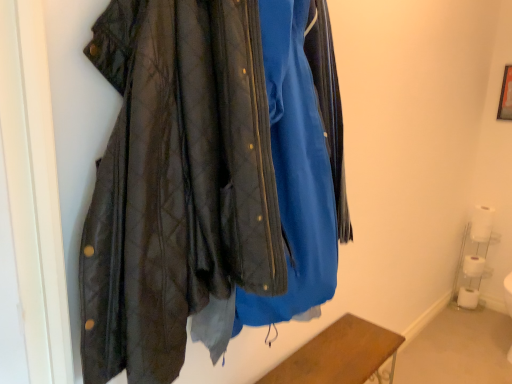
This screenshot has width=512, height=384. What do you see at coordinates (468, 298) in the screenshot?
I see `white matte toilet paper at lower right, positioned as the 1th toilet paper in bottom-to-top order` at bounding box center [468, 298].

Locate an element on the screen. The width and height of the screenshot is (512, 384). white matte toilet paper at lower right, which is counted as the 3th toilet paper, starting from the top is located at coordinates (473, 266).

What's the angular difference between white matte toilet paper at lower right, the fourth toilet paper positioned from the bottom, and white matte toilet paper at lower right, positioned as the 1th toilet paper in bottom-to-top order,'s facing directions?

A: There is a 0.0113-degree angle between the facing directions of white matte toilet paper at lower right, the fourth toilet paper positioned from the bottom, and white matte toilet paper at lower right, positioned as the 1th toilet paper in bottom-to-top order.

Is white matte toilet paper at lower right, which appears as the 1th toilet paper when viewed from the top, wider or thinner than white matte toilet paper at lower right, positioned as the 1th toilet paper in bottom-to-top order?

Considering their sizes, white matte toilet paper at lower right, which appears as the 1th toilet paper when viewed from the top, looks slimmer than white matte toilet paper at lower right, positioned as the 1th toilet paper in bottom-to-top order.

Would you say white matte toilet paper at lower right, the fourth toilet paper in the top-to-bottom sequence, is part of white matte toilet paper at lower right, the fourth toilet paper positioned from the bottom,'s contents?

No, white matte toilet paper at lower right, the fourth toilet paper in the top-to-bottom sequence, is located outside of white matte toilet paper at lower right, the fourth toilet paper positioned from the bottom.

From the image's perspective, which is below, white matte toilet paper at lower right, the fourth toilet paper positioned from the bottom, or white matte toilet paper at lower right, the fourth toilet paper in the top-to-bottom sequence?

white matte toilet paper at lower right, the fourth toilet paper in the top-to-bottom sequence, from the image's perspective.

Looking at this image, is white matte toilet paper at lower right, the fourth toilet paper positioned from the bottom, placed right next to brown wooden table at lower center?

No.

From the image's perspective, is white matte toilet paper at lower right, the fourth toilet paper positioned from the bottom, located above or below brown wooden table at lower center?

From the image's perspective, white matte toilet paper at lower right, the fourth toilet paper positioned from the bottom, appears above brown wooden table at lower center.

Is white matte toilet paper at lower right, the fourth toilet paper positioned from the bottom, oriented towards brown wooden table at lower center?

Yes, white matte toilet paper at lower right, the fourth toilet paper positioned from the bottom, is aimed at brown wooden table at lower center.

Based on the photo, considering the sizes of objects white matte toilet paper at lower right, the fourth toilet paper positioned from the bottom, and brown wooden table at lower center in the image provided, who is wider, white matte toilet paper at lower right, the fourth toilet paper positioned from the bottom, or brown wooden table at lower center?

Wider between the two is brown wooden table at lower center.

Are white matte toilet paper at lower right, which appears as the 1th toilet paper when viewed from the top, and wooden frame at upper right making contact?

No, white matte toilet paper at lower right, which appears as the 1th toilet paper when viewed from the top, is not touching wooden frame at upper right.

Which of these two, white matte toilet paper at lower right, which appears as the 1th toilet paper when viewed from the top, or wooden frame at upper right, is smaller?

With smaller size is wooden frame at upper right.

Consider the image. How distant is white matte toilet paper at lower right, the fourth toilet paper positioned from the bottom, from wooden frame at upper right?

white matte toilet paper at lower right, the fourth toilet paper positioned from the bottom, is 27.10 inches from wooden frame at upper right.

Does white matte toilet paper at lower right, which appears as the 1th toilet paper when viewed from the top, turn towards wooden frame at upper right?

No, white matte toilet paper at lower right, which appears as the 1th toilet paper when viewed from the top, is not facing towards wooden frame at upper right.

Based on the photo, does white matte toilet paper at lower right, the fourth toilet paper in the top-to-bottom sequence, have a lesser height compared to white plastic shelf at lower right?

Yes.

Which is behind, point (476, 305) or point (478, 267)?

Point (476, 305)

From the image's perspective, is white matte toilet paper at lower right, positioned as the 1th toilet paper in bottom-to-top order, under white plastic shelf at lower right?

Yes.

Do you think white matte toilet paper at lower right, positioned as the 1th toilet paper in bottom-to-top order, is within white plastic shelf at lower right, or outside of it?

white matte toilet paper at lower right, positioned as the 1th toilet paper in bottom-to-top order, is contained in white plastic shelf at lower right.

Is wooden frame at upper right positioned with its back to white paper towel at lower right, arranged as the second toilet paper when viewed from the top?

No, white paper towel at lower right, arranged as the second toilet paper when viewed from the top, is not at the back of wooden frame at upper right.

Is wooden frame at upper right in front of or behind white paper towel at lower right, which is the 3th toilet paper in bottom-to-top order, in the image?

wooden frame at upper right is in front of white paper towel at lower right, which is the 3th toilet paper in bottom-to-top order.

Is wooden frame at upper right taller than white paper towel at lower right, which is the 3th toilet paper in bottom-to-top order?

Yes.

Are white paper towel at lower right, arranged as the second toilet paper when viewed from the top, and white plastic shelf at lower right beside each other?

No, white paper towel at lower right, arranged as the second toilet paper when viewed from the top, is not next to white plastic shelf at lower right.

Is white paper towel at lower right, which is the 3th toilet paper in bottom-to-top order, surrounding white plastic shelf at lower right?

No.

In the scene shown: Is white paper towel at lower right, which is the 3th toilet paper in bottom-to-top order, looking in the opposite direction of white plastic shelf at lower right?

white paper towel at lower right, which is the 3th toilet paper in bottom-to-top order, is not turned away from white plastic shelf at lower right.

Is white matte toilet paper at lower right, the fourth toilet paper in the top-to-bottom sequence, surrounded by white paper towel at lower right, which is the 3th toilet paper in bottom-to-top order?

Definitely not — white matte toilet paper at lower right, the fourth toilet paper in the top-to-bottom sequence, is not inside white paper towel at lower right, which is the 3th toilet paper in bottom-to-top order.

From the image's perspective, which object appears higher, white paper towel at lower right, which is the 3th toilet paper in bottom-to-top order, or white matte toilet paper at lower right, positioned as the 1th toilet paper in bottom-to-top order?

white paper towel at lower right, which is the 3th toilet paper in bottom-to-top order, from the image's perspective.

Are white paper towel at lower right, which is the 3th toilet paper in bottom-to-top order, and white matte toilet paper at lower right, positioned as the 1th toilet paper in bottom-to-top order, beside each other?

No, white paper towel at lower right, which is the 3th toilet paper in bottom-to-top order, is not next to white matte toilet paper at lower right, positioned as the 1th toilet paper in bottom-to-top order.

Considering the sizes of objects white paper towel at lower right, which is the 3th toilet paper in bottom-to-top order, and white matte toilet paper at lower right, positioned as the 1th toilet paper in bottom-to-top order, in the image provided, who is taller, white paper towel at lower right, which is the 3th toilet paper in bottom-to-top order, or white matte toilet paper at lower right, positioned as the 1th toilet paper in bottom-to-top order,?

With more height is white matte toilet paper at lower right, positioned as the 1th toilet paper in bottom-to-top order.

Which toilet paper is the 2nd one when counting from the left side of the white matte toilet paper at lower right, which appears as the 1th toilet paper when viewed from the top? Please provide its 2D coordinates.

[(468, 298)]

I want to click on toilet paper that is the 4th one when counting rightward from the brown wooden table at lower center, so click(x=482, y=223).

Looking at the image, which one is located further to white paper towel at lower right, which is the 3th toilet paper in bottom-to-top order, brown wooden table at lower center or white matte toilet paper at lower right, which is the second toilet paper in bottom-to-top order?

brown wooden table at lower center is positioned further to the anchor white paper towel at lower right, which is the 3th toilet paper in bottom-to-top order.

Considering their positions, is white matte toilet paper at lower right, which appears as the 1th toilet paper when viewed from the top, positioned further to white matte toilet paper at lower right, which is counted as the 3th toilet paper, starting from the top, than white plastic shelf at lower right?

white matte toilet paper at lower right, which appears as the 1th toilet paper when viewed from the top, is further to white matte toilet paper at lower right, which is counted as the 3th toilet paper, starting from the top.

Looking at the image, which one is located further to wooden frame at upper right, brown wooden table at lower center or white matte toilet paper at lower right, which is counted as the 3th toilet paper, starting from the top?

Based on the image, brown wooden table at lower center appears to be further to wooden frame at upper right.

Based on their spatial positions, is white matte toilet paper at lower right, which is the second toilet paper in bottom-to-top order, or white matte toilet paper at lower right, which appears as the 1th toilet paper when viewed from the top, closer to wooden frame at upper right?

Based on the image, white matte toilet paper at lower right, which appears as the 1th toilet paper when viewed from the top, appears to be nearer to wooden frame at upper right.

From the image, which object appears to be nearer to white matte toilet paper at lower right, which appears as the 1th toilet paper when viewed from the top, white matte toilet paper at lower right, which is counted as the 3th toilet paper, starting from the top, or white matte toilet paper at lower right, the fourth toilet paper in the top-to-bottom sequence?

white matte toilet paper at lower right, which is counted as the 3th toilet paper, starting from the top.

Which object lies nearer to the anchor point white plastic shelf at lower right, wooden frame at upper right or white matte toilet paper at lower right, the fourth toilet paper in the top-to-bottom sequence?

Among the two, white matte toilet paper at lower right, the fourth toilet paper in the top-to-bottom sequence, is located nearer to white plastic shelf at lower right.

From the image, which object appears to be farther from brown wooden table at lower center, white paper towel at lower right, arranged as the second toilet paper when viewed from the top, or white matte toilet paper at lower right, which is the second toilet paper in bottom-to-top order?

Based on the image, white paper towel at lower right, arranged as the second toilet paper when viewed from the top, appears to be further to brown wooden table at lower center.

Estimate the real-world distances between objects in this image. Which object is further from wooden frame at upper right, white matte toilet paper at lower right, the fourth toilet paper positioned from the bottom, or white matte toilet paper at lower right, which is the second toilet paper in bottom-to-top order?

white matte toilet paper at lower right, which is the second toilet paper in bottom-to-top order, lies further to wooden frame at upper right than the other object.

This screenshot has width=512, height=384. Identify the location of shelf between brown wooden table at lower center and white paper towel at lower right, which is the 3th toilet paper in bottom-to-top order, in the front-back direction. (473, 262).

Where is `toilet paper between white paper towel at lower right, which is the 3th toilet paper in bottom-to-top order, and white matte toilet paper at lower right, positioned as the 1th toilet paper in bottom-to-top order, from top to bottom`? toilet paper between white paper towel at lower right, which is the 3th toilet paper in bottom-to-top order, and white matte toilet paper at lower right, positioned as the 1th toilet paper in bottom-to-top order, from top to bottom is located at coordinates (473, 266).

Locate an element on the screen. The width and height of the screenshot is (512, 384). toilet paper between wooden frame at upper right and white paper towel at lower right, arranged as the second toilet paper when viewed from the top, in the up-down direction is located at coordinates (482, 223).

Identify the location of picture frame between brown wooden table at lower center and white matte toilet paper at lower right, which is counted as the 3th toilet paper, starting from the top, in the front-back direction. Image resolution: width=512 pixels, height=384 pixels. (506, 96).